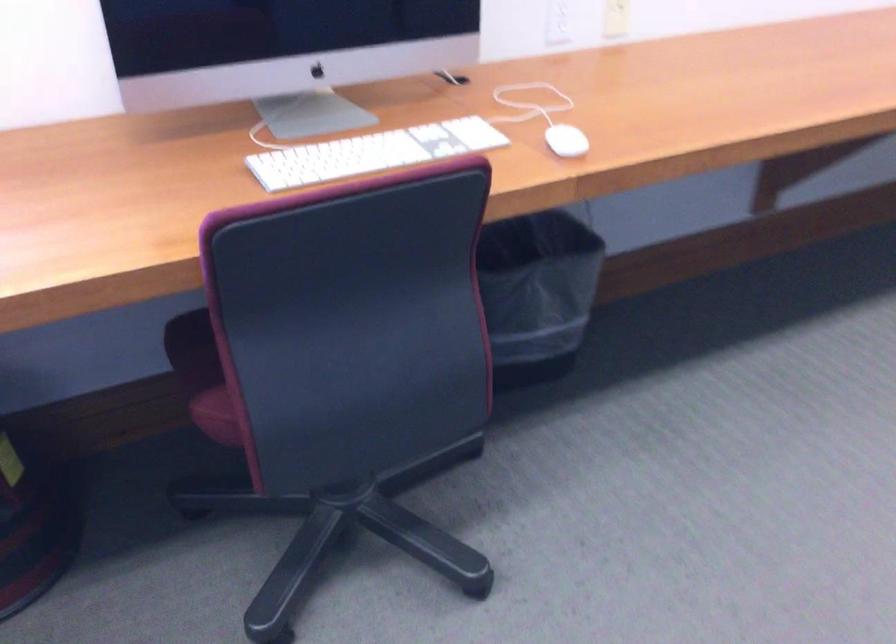
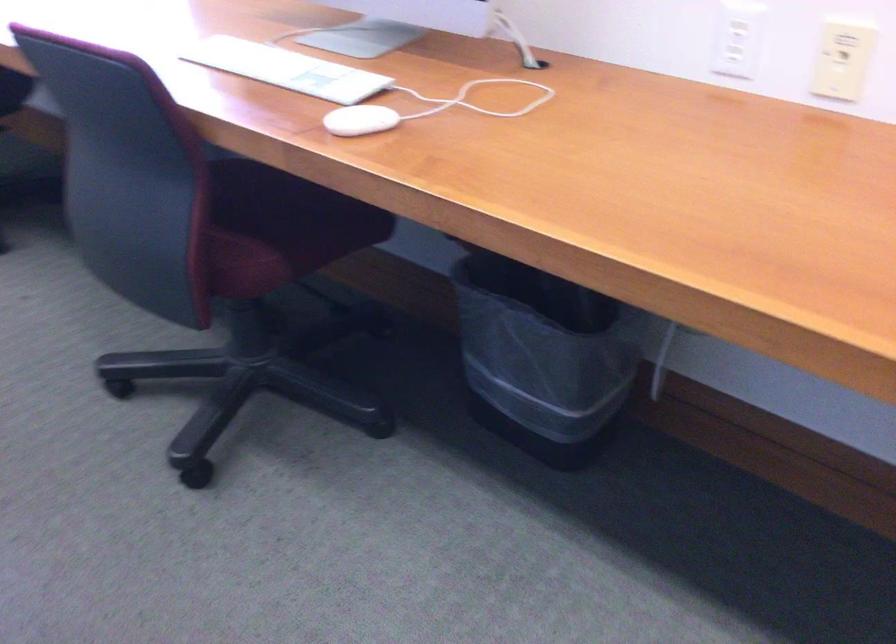
In the second image, find the point that corresponds to point (391, 147) in the first image.

(286, 69)